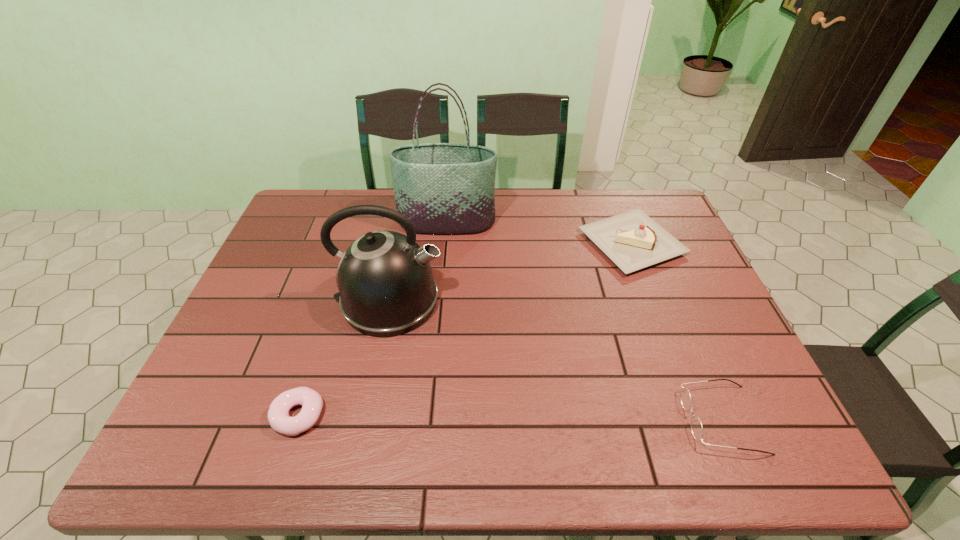
The height and width of the screenshot is (540, 960). I want to click on free space located through the lenses of the spectacles, so click(621, 419).

Locate an element on the screen. vacant region located on the right of the doughnut is located at coordinates (410, 415).

Find the location of a particular element. The image size is (960, 540). tote bag that is at the far edge is located at coordinates (442, 188).

Where is `cake positioned at the far edge`? cake positioned at the far edge is located at coordinates (632, 240).

Locate an element on the screen. The height and width of the screenshot is (540, 960). spectacles at the near edge is located at coordinates (696, 426).

The image size is (960, 540). What are the coordinates of `doughnut located at the near edge` in the screenshot? It's located at (278, 415).

Locate an element on the screen. This screenshot has height=540, width=960. cake positioned at the right edge is located at coordinates click(x=632, y=240).

In order to click on spectacles positioned at the right edge in this screenshot , I will do `click(696, 426)`.

Identify the location of object located at the far right corner. (632, 240).

Where is `object positioned at the near right corner`? This screenshot has width=960, height=540. object positioned at the near right corner is located at coordinates (696, 426).